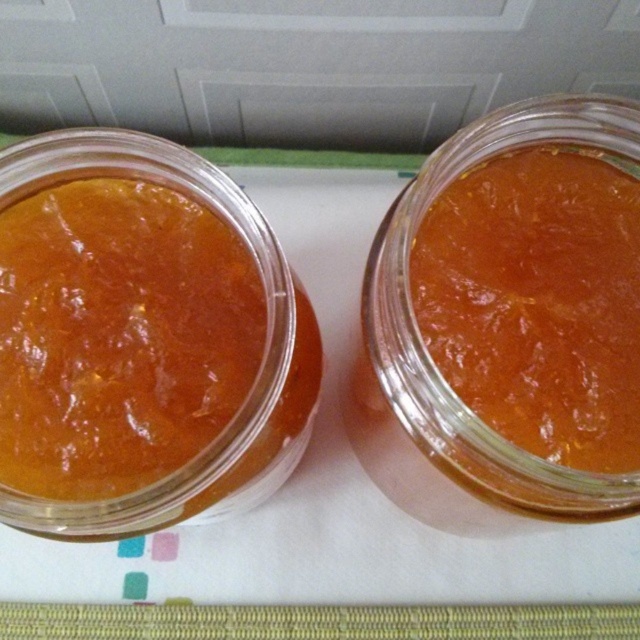
Is the position of matte orange jam at left less distant than that of translucent glass jar at center?

No.

Between point (115, 490) and point (404, 204), which one is positioned in front?

Positioned in front is point (115, 490).

Locate an element on the screen. This screenshot has height=640, width=640. matte orange jam at left is located at coordinates (118, 336).